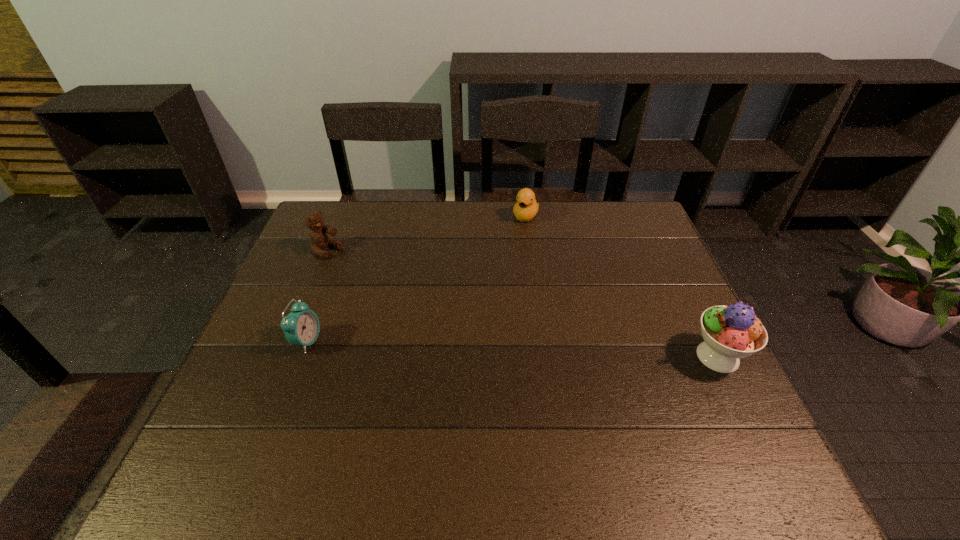
Where is `vacant spot on the desktop that is between the alarm clock and the rightmost object and is positioned on the face of the duckling`? The width and height of the screenshot is (960, 540). vacant spot on the desktop that is between the alarm clock and the rightmost object and is positioned on the face of the duckling is located at coordinates (471, 348).

The height and width of the screenshot is (540, 960). Find the location of `free space on the desktop that is between the alarm clock and the icecream and is positioned on the face of the third nearest object`. free space on the desktop that is between the alarm clock and the icecream and is positioned on the face of the third nearest object is located at coordinates (479, 348).